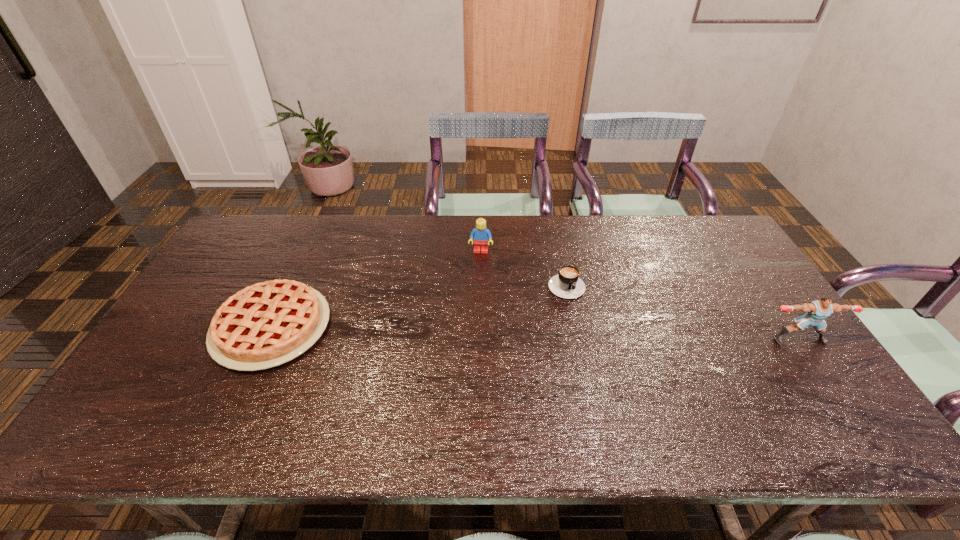
Identify the location of free region located 0.270m on the face of the third object from right to left. (473, 315).

The height and width of the screenshot is (540, 960). In order to click on free spot located 0.310m with the handle on the side of the second object from right to left in this screenshot , I will do `click(612, 388)`.

Find the location of a particular element. The width and height of the screenshot is (960, 540). vacant space located with the handle on the side of the second object from right to left is located at coordinates (600, 362).

At what (x,y) coordinates should I click in order to perform the action: click on free space located with the handle on the side of the second object from right to left. Please return your answer as a coordinate pair (x, y). This screenshot has height=540, width=960. Looking at the image, I should click on (610, 385).

This screenshot has height=540, width=960. Identify the location of object at the far edge. point(480,234).

You are a GUI agent. You are given a task and a screenshot of the screen. Output one action in this format:
    pyautogui.click(x=<x>, y=<y>)
    Task: Click on the object situated at the left edge
    The width and height of the screenshot is (960, 540).
    Given the screenshot: What is the action you would take?
    pyautogui.click(x=265, y=325)

Locate an element on the screen. Image resolution: width=960 pixels, height=540 pixels. object at the right edge is located at coordinates (817, 311).

You are a GUI agent. You are given a task and a screenshot of the screen. Output one action in this format:
    pyautogui.click(x=<x>, y=<y>)
    Task: Click on the free space at the far edge of the desktop
    This screenshot has height=540, width=960.
    Given the screenshot: What is the action you would take?
    pyautogui.click(x=335, y=252)

Where is `free space at the near edge of the desktop`? free space at the near edge of the desktop is located at coordinates (725, 388).

At what (x,y) coordinates should I click in order to perform the action: click on free location at the left edge of the desktop. Please return your answer as a coordinate pair (x, y). This screenshot has height=540, width=960. Looking at the image, I should click on (233, 274).